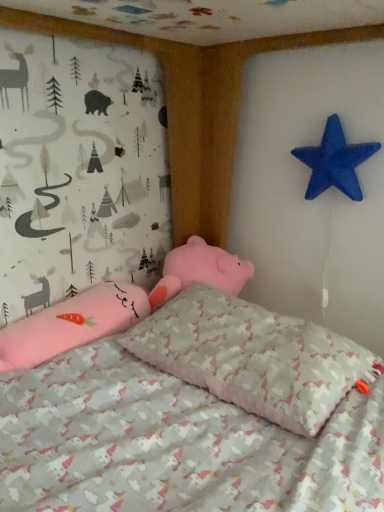
Question: Relative to blue matte star at upper right, is unicorn-patterned fabric pillow at center in front or behind?

Choices:
 (A) behind
 (B) front

Answer: (B)

Question: Visually, is unicorn-patterned fabric pillow at center positioned to the left or to the right of blue matte star at upper right?

Choices:
 (A) left
 (B) right

Answer: (A)

Question: Considering the positions of unicorn-patterned fabric pillow at center and blue matte star at upper right in the image, is unicorn-patterned fabric pillow at center wider or thinner than blue matte star at upper right?

Choices:
 (A) thin
 (B) wide

Answer: (B)

Question: Choose the correct answer: Is blue matte star at upper right inside unicorn-patterned fabric pillow at center or outside it?

Choices:
 (A) outside
 (B) inside

Answer: (A)

Question: From their relative heights in the image, would you say blue matte star at upper right is taller or shorter than unicorn-patterned fabric pillow at center?

Choices:
 (A) tall
 (B) short

Answer: (A)

Question: Considering the positions of blue matte star at upper right and unicorn-patterned fabric pillow at center in the image, is blue matte star at upper right wider or thinner than unicorn-patterned fabric pillow at center?

Choices:
 (A) wide
 (B) thin

Answer: (B)

Question: In terms of size, does blue matte star at upper right appear bigger or smaller than unicorn-patterned fabric pillow at center?

Choices:
 (A) small
 (B) big

Answer: (A)